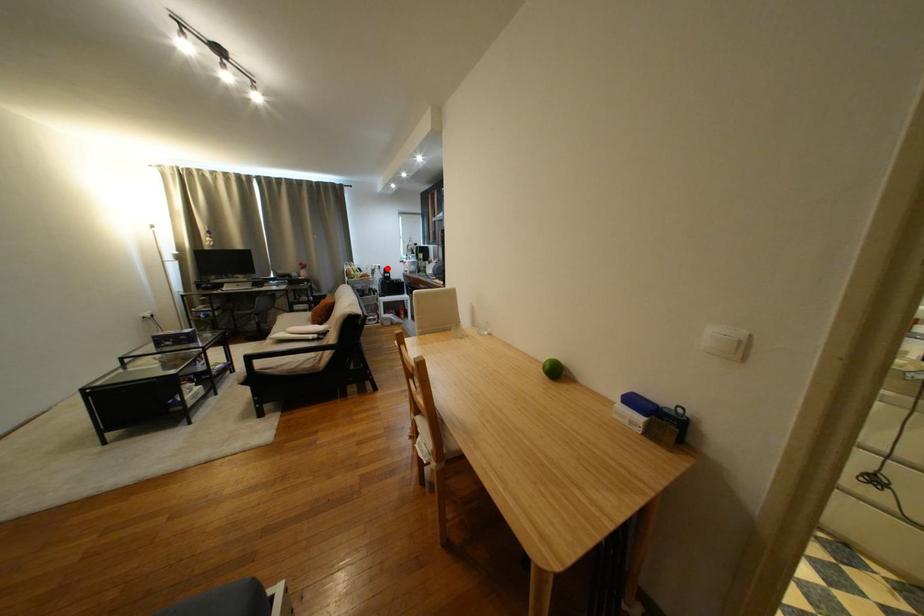
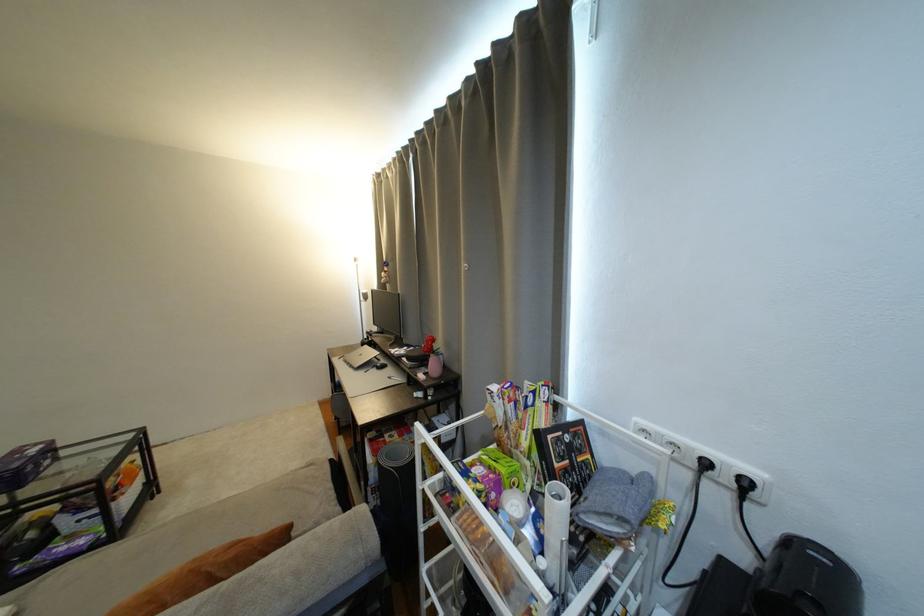
Question: A red point is marked in image1. In image2, is the corresponding 3D point closer to the camera or farther? Reply with the corresponding letter.

Choices:
 (A) The corresponding 3D point is closer.
 (B) The corresponding 3D point is farther.

Answer: (B)